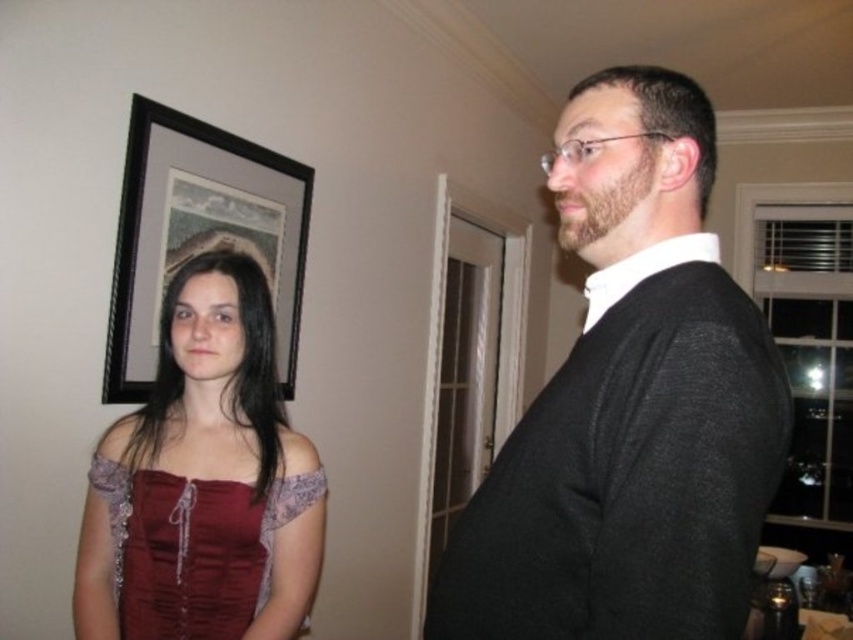
Question: Observing the image, what is the correct spatial positioning of velvet dress at left in reference to velvet-like burgundy dress at left?

Choices:
 (A) right
 (B) left

Answer: (B)

Question: Which is nearer to the velvet dress at left?

Choices:
 (A) black wood picture frame at upper left
 (B) velvet-like burgundy dress at left

Answer: (B)

Question: Based on their relative distances, which object is farther from the velvet-like burgundy dress at left?

Choices:
 (A) black wood picture frame at upper left
 (B) black sweater at right

Answer: (A)

Question: Can you confirm if velvet dress at left is positioned below black wood picture frame at upper left?

Choices:
 (A) no
 (B) yes

Answer: (B)

Question: Does velvet dress at left have a lesser width compared to velvet-like burgundy dress at left?

Choices:
 (A) no
 (B) yes

Answer: (A)

Question: Which object is farther from the camera taking this photo?

Choices:
 (A) velvet-like burgundy dress at left
 (B) velvet dress at left

Answer: (A)